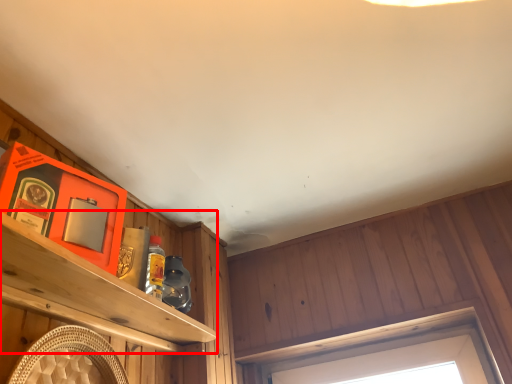
Question: Observing the image, what is the correct spatial positioning of shelf (annotated by the red box) in reference to window?

Choices:
 (A) right
 (B) left

Answer: (B)